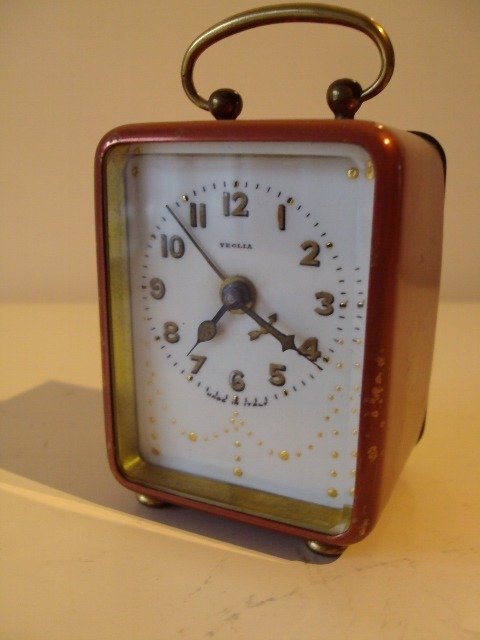
The image size is (480, 640). In order to click on clock in this screenshot , I will do `click(267, 262)`.